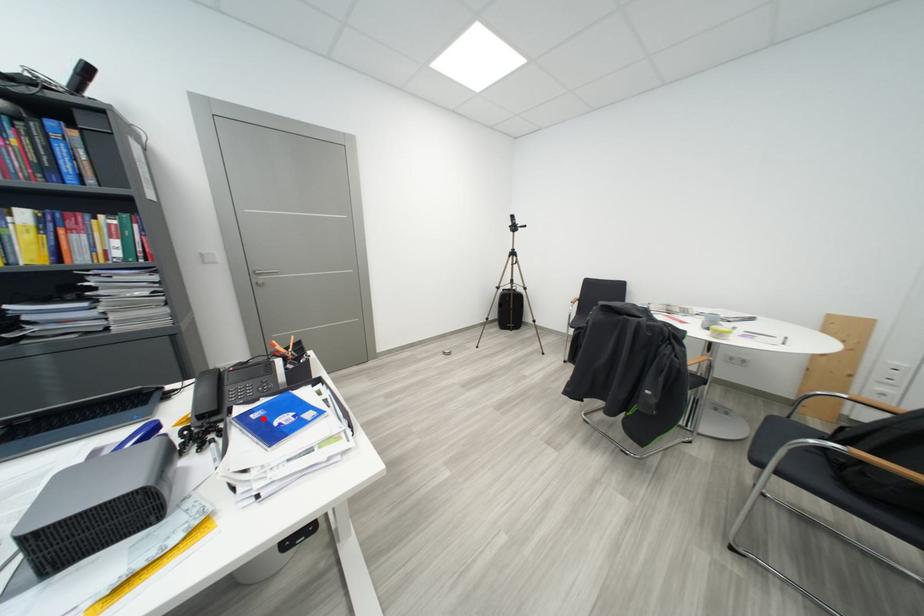
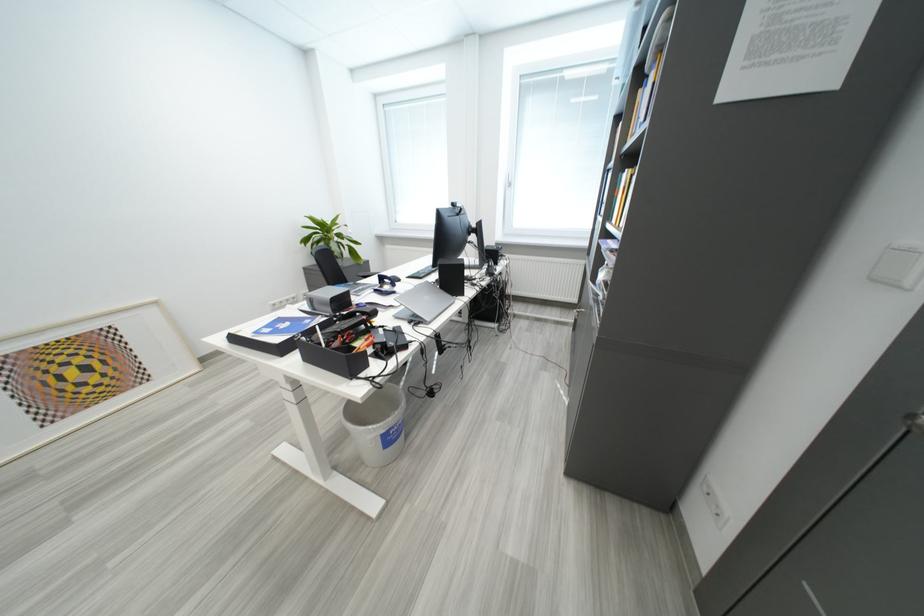
In the second image, find the point that corresponds to the highlighted location in the first image.

(317, 323)